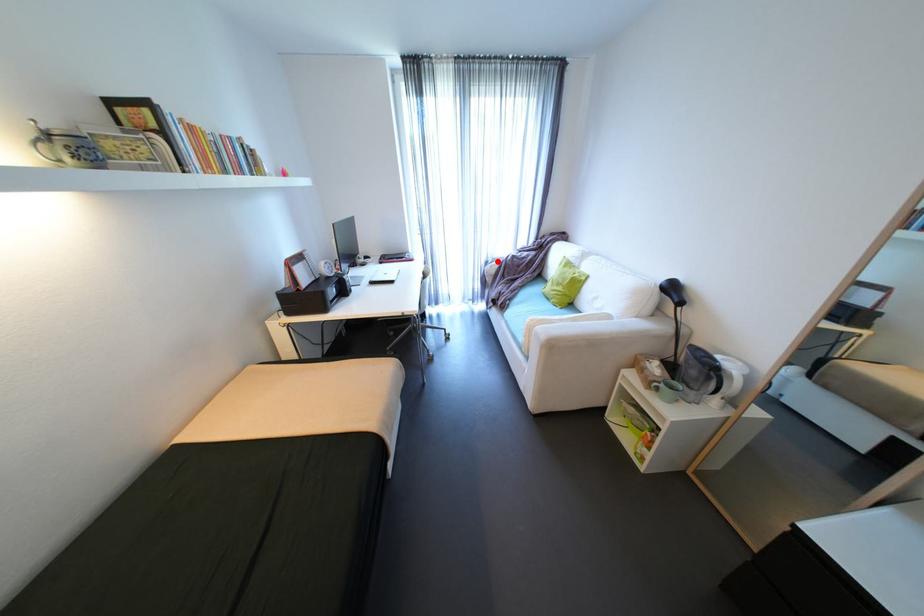
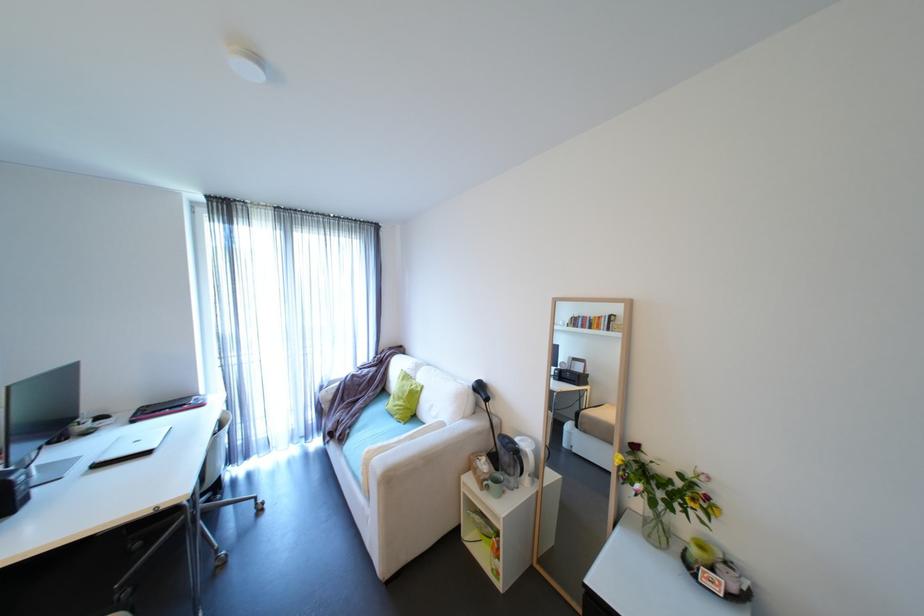
Question: A red point is marked in image1. In image2, is the corresponding 3D point closer to the camera or farther? Reply with the corresponding letter.

Choices:
 (A) The corresponding 3D point is closer.
 (B) The corresponding 3D point is farther.

Answer: (B)